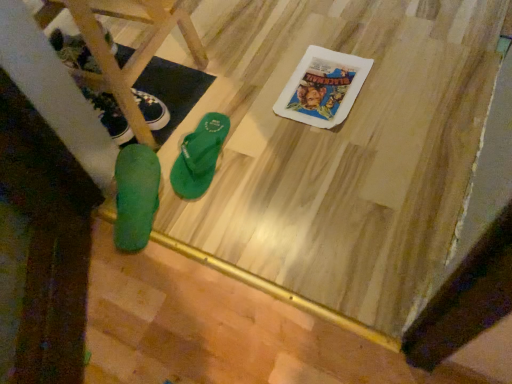
This screenshot has width=512, height=384. Identify the location of vacant area located to the right-hand side of green rubber flip-flops at lower left. (242, 72).